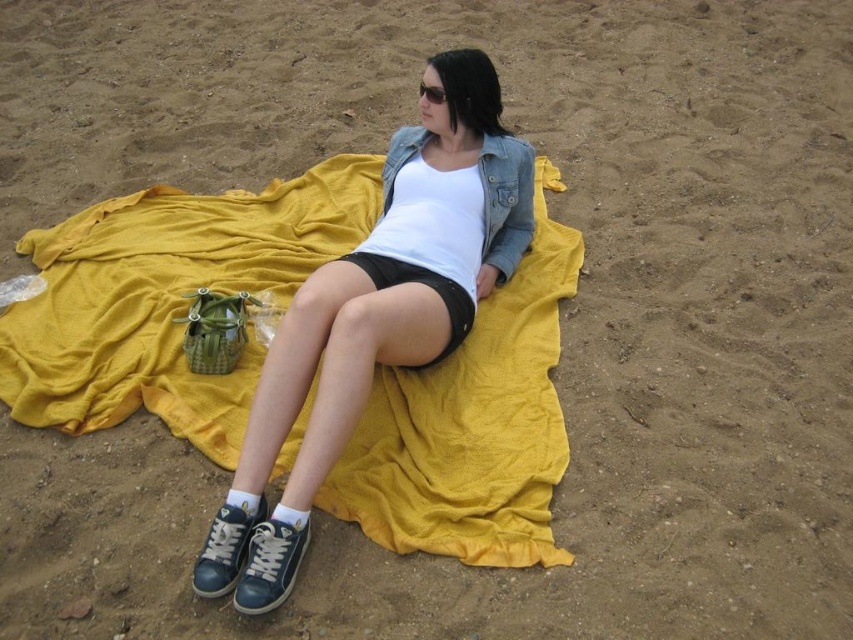
You are a photographer trying to capture the exact location of the dark blue canvas sneaker at lower center in the image. According to the coordinates provided, where would you focus your camera lens to ensure the sneaker is centered in the frame?

The dark blue canvas sneaker at lower center is located at coordinates point (270, 563), so you should focus your camera lens on that point to center it in the frame.

You are packing for a beach trip and have a small backpack. You want to bring both the yellow fabric blanket at center and the matte black shorts at center. However, your backpack has limited space. Which item should you pack first to ensure both fit?

The yellow fabric blanket at center is shorter than the matte black shorts at center, so you should pack the matte black shorts at center first since it takes up more space vertically, allowing the shorter blanket to fit alongside.